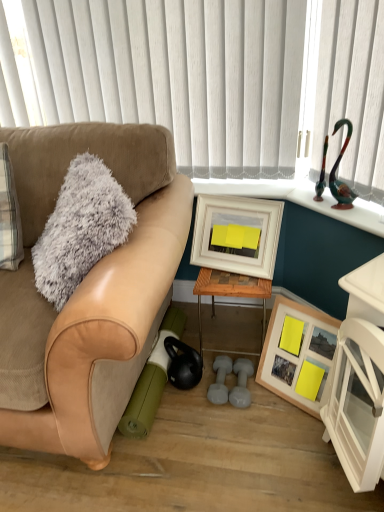
Question: Is suede tan couch at left a part of woodenmaterial/texturetable at center?

Choices:
 (A) yes
 (B) no

Answer: (B)

Question: Considering the relative sizes of woodenmaterial/texturetable at center and suede tan couch at left in the image provided, is woodenmaterial/texturetable at center bigger than suede tan couch at left?

Choices:
 (A) yes
 (B) no

Answer: (B)

Question: From a real-world perspective, is woodenmaterial/texturetable at center physically below suede tan couch at left?

Choices:
 (A) yes
 (B) no

Answer: (A)

Question: Is woodenmaterial/texturetable at center closer to camera compared to suede tan couch at left?

Choices:
 (A) no
 (B) yes

Answer: (A)

Question: From a real-world perspective, is woodenmaterial/texturetable at center over suede tan couch at left?

Choices:
 (A) no
 (B) yes

Answer: (A)

Question: From the image's perspective, is woodenmaterial/texturetable at center located above or below suede tan couch at left?

Choices:
 (A) above
 (B) below

Answer: (B)

Question: Is woodenmaterial/texturetable at center situated inside suede tan couch at left or outside?

Choices:
 (A) inside
 (B) outside

Answer: (B)

Question: Considering the positions of woodenmaterial/texturetable at center and suede tan couch at left in the image, is woodenmaterial/texturetable at center bigger or smaller than suede tan couch at left?

Choices:
 (A) big
 (B) small

Answer: (B)

Question: Considering the relative positions of woodenmaterial/texturetable at center and suede tan couch at left in the image provided, is woodenmaterial/texturetable at center to the left or to the right of suede tan couch at left?

Choices:
 (A) left
 (B) right

Answer: (B)

Question: From the image's perspective, relative to white vertical blinds at upper center, is suede tan couch at left above or below?

Choices:
 (A) below
 (B) above

Answer: (A)

Question: From a real-world perspective, relative to white vertical blinds at upper center, is suede tan couch at left vertically above or below?

Choices:
 (A) above
 (B) below

Answer: (B)

Question: Based on their positions, is suede tan couch at left located to the left or right of white vertical blinds at upper center?

Choices:
 (A) left
 (B) right

Answer: (A)

Question: Considering the positions of suede tan couch at left and white vertical blinds at upper center in the image, is suede tan couch at left wider or thinner than white vertical blinds at upper center?

Choices:
 (A) wide
 (B) thin

Answer: (A)

Question: Considering the positions of white vertical blinds at upper center and fuzzy gray throw pillow at left in the image, is white vertical blinds at upper center wider or thinner than fuzzy gray throw pillow at left?

Choices:
 (A) thin
 (B) wide

Answer: (A)

Question: Which is correct: white vertical blinds at upper center is inside fuzzy gray throw pillow at left, or outside of it?

Choices:
 (A) outside
 (B) inside

Answer: (A)